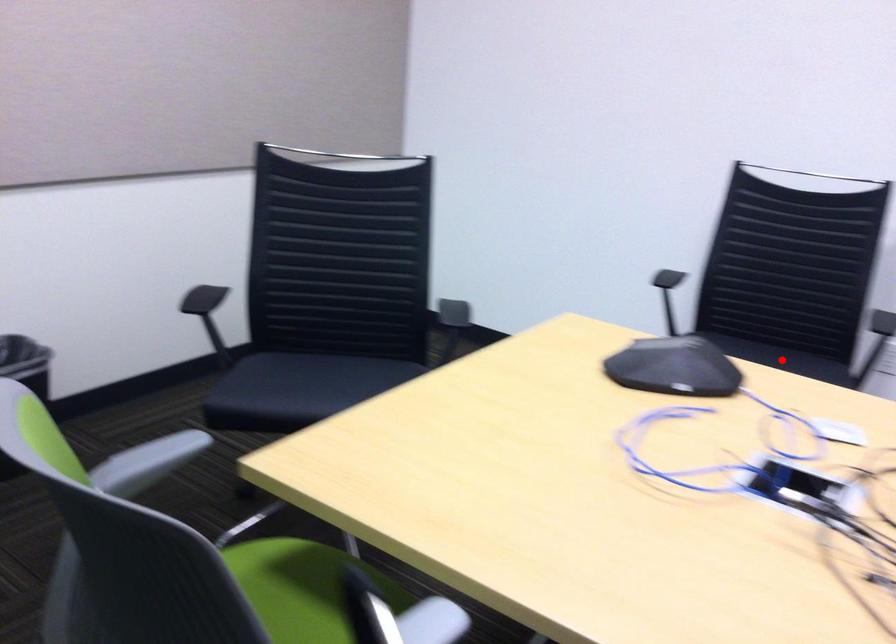
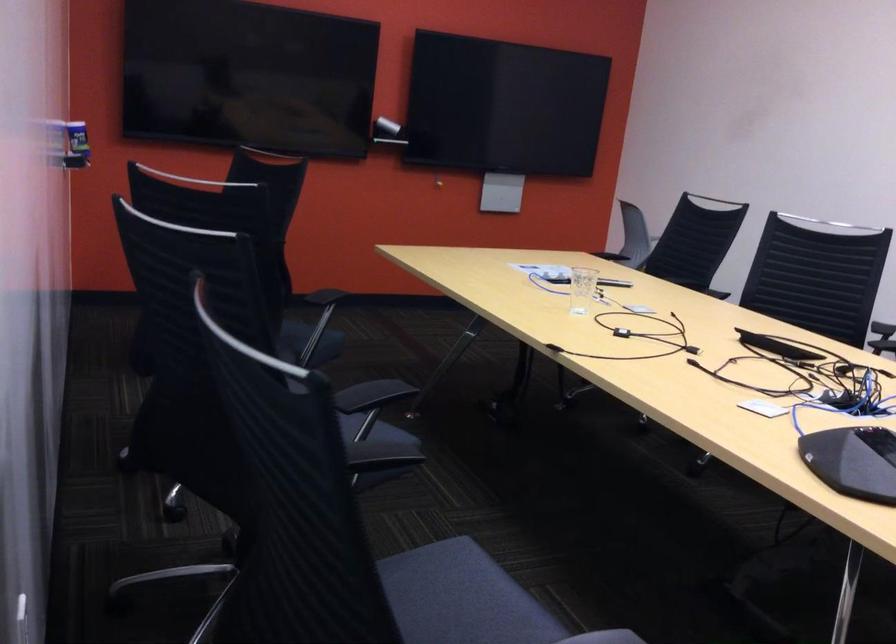
Question: A red point is marked in image1. In image2, is the corresponding 3D point closer to the camera or farther? Reply with the corresponding letter.

Choices:
 (A) The corresponding 3D point is closer.
 (B) The corresponding 3D point is farther.

Answer: (A)